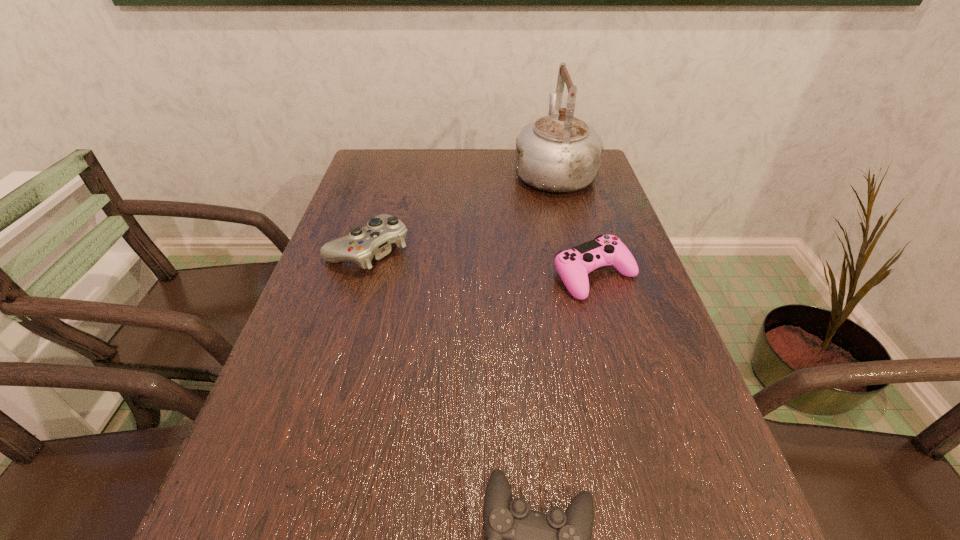
The height and width of the screenshot is (540, 960). I want to click on kettle, so click(x=556, y=153).

The width and height of the screenshot is (960, 540). Identify the location of the tallest object. [x=556, y=153].

You are a GUI agent. You are given a task and a screenshot of the screen. Output one action in this format:
    pyautogui.click(x=<x>, y=<y>)
    Task: Click on the leftmost object
    The image size is (960, 540).
    Given the screenshot: What is the action you would take?
    pyautogui.click(x=374, y=241)

Where is `the rightmost control`? The height and width of the screenshot is (540, 960). the rightmost control is located at coordinates (573, 266).

Locate an element on the screen. The image size is (960, 540). vacant space located 0.060m on the front of the leftmost control is located at coordinates (354, 296).

The width and height of the screenshot is (960, 540). Identify the location of vacant region located on the back of the rightmost control. (584, 238).

Locate an element on the screen. This screenshot has width=960, height=540. object that is at the far edge is located at coordinates (556, 153).

This screenshot has height=540, width=960. What are the coordinates of `object that is at the left edge` in the screenshot? It's located at (374, 241).

In order to click on kettle located at the right edge in this screenshot , I will do `click(556, 153)`.

Where is `control present at the right edge`? This screenshot has height=540, width=960. control present at the right edge is located at coordinates (573, 266).